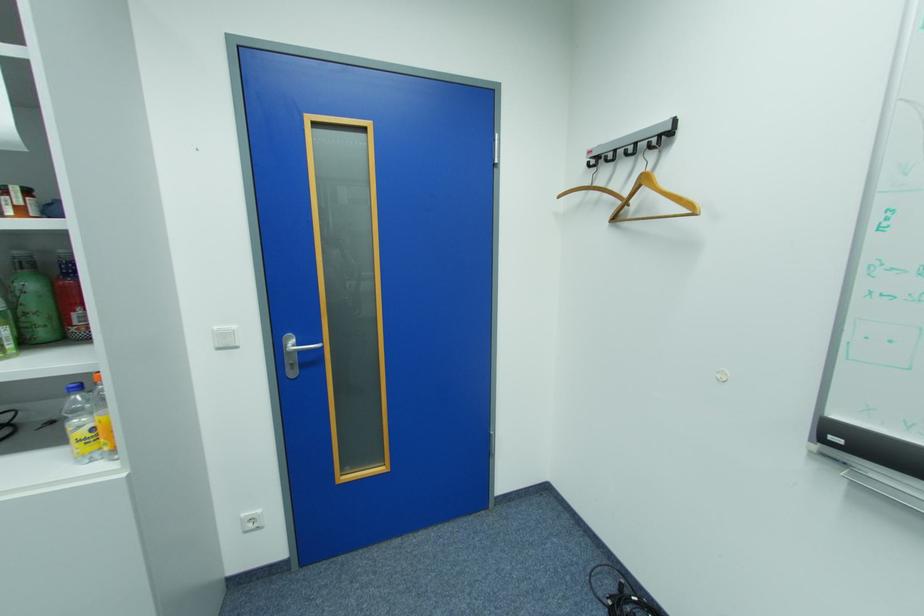
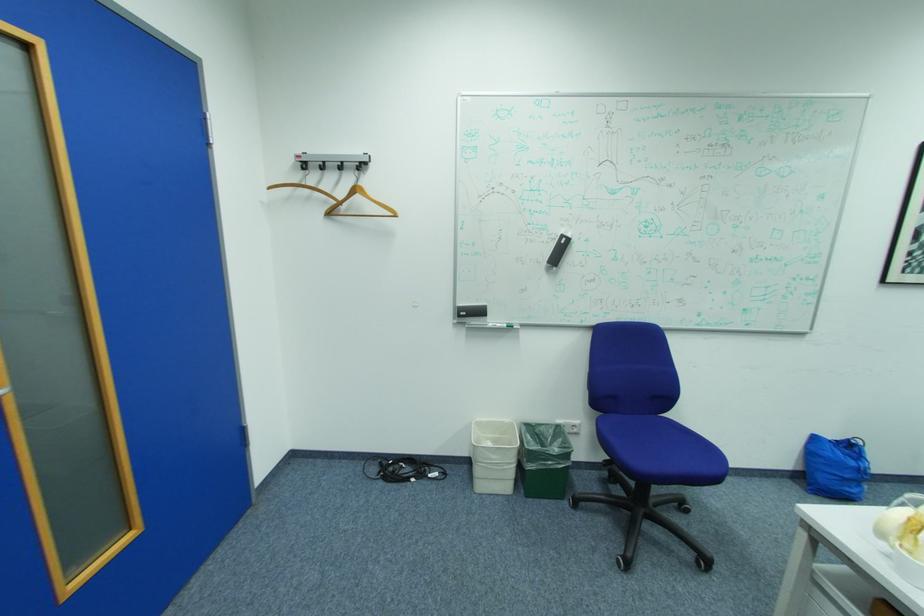
Locate, in the second image, the point that corresponds to [624,220] in the first image.

(337, 214)